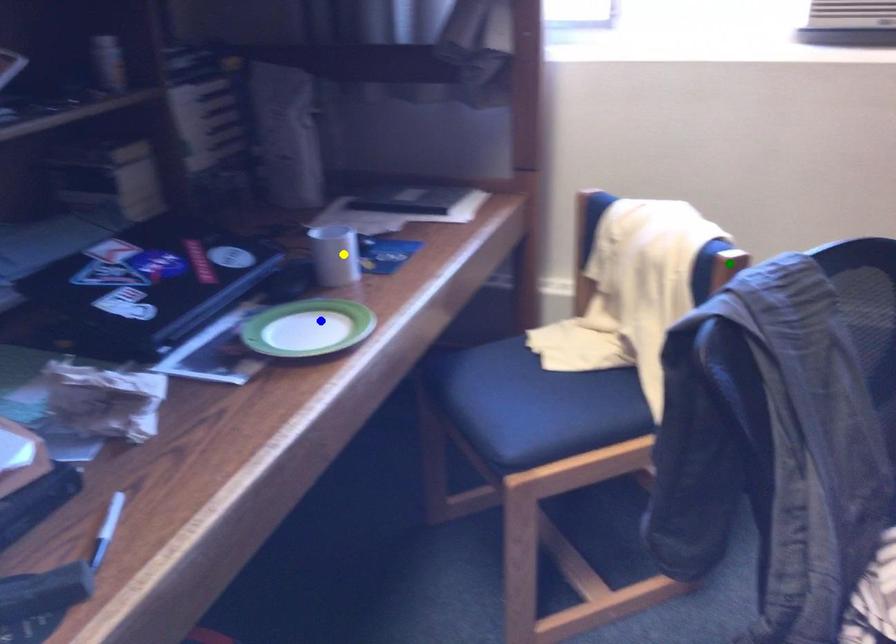
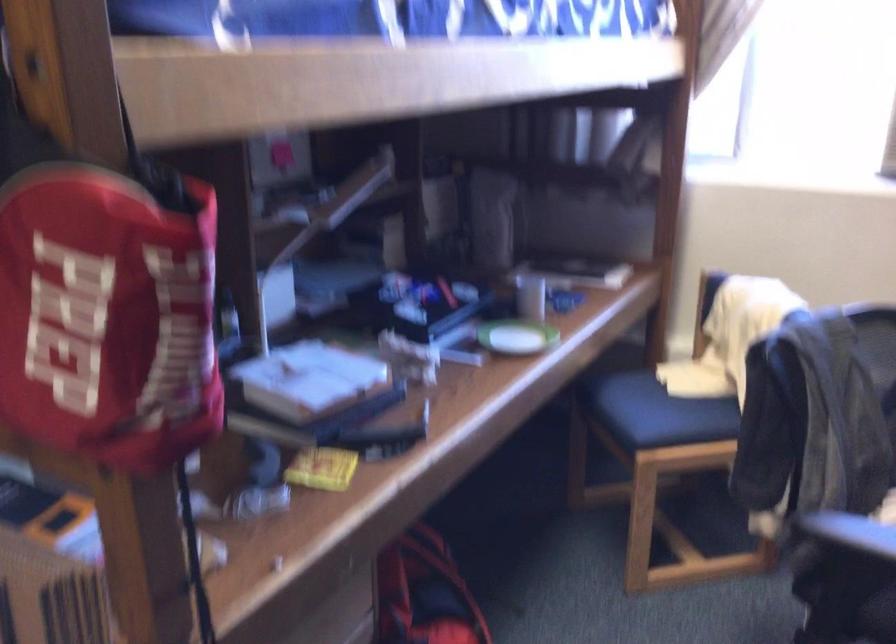
I am providing you with two images of the same scene from different viewpoints. Three points are marked in image1. Which point corresponds to a part or object that is occluded in image2?In image1, three points are marked. Which of them correspond to a part or object that is occluded in image2?Among the three points shown in image1, which one corresponds to a part or object that is no longer visible due to occlusion in image2?

green point